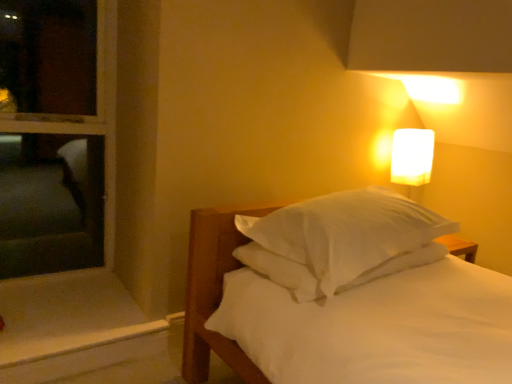
Question: From the image's perspective, does white frosted glass at upper right appear lower than white soft bed at center?

Choices:
 (A) no
 (B) yes

Answer: (A)

Question: Is white frosted glass at upper right closer to the viewer compared to white soft bed at center?

Choices:
 (A) no
 (B) yes

Answer: (A)

Question: Does white frosted glass at upper right appear on the left side of white soft bed at center?

Choices:
 (A) no
 (B) yes

Answer: (A)

Question: Does white frosted glass at upper right contain white soft bed at center?

Choices:
 (A) no
 (B) yes

Answer: (A)

Question: Is white frosted glass at upper right wider than white soft bed at center?

Choices:
 (A) yes
 (B) no

Answer: (B)

Question: From their relative heights in the image, would you say white soft bed at center is taller or shorter than white wood window sill at lower left?

Choices:
 (A) short
 (B) tall

Answer: (B)

Question: In the image, is white soft bed at center on the left side or the right side of white wood window sill at lower left?

Choices:
 (A) right
 (B) left

Answer: (A)

Question: Looking at their shapes, would you say white soft bed at center is wider or thinner than white wood window sill at lower left?

Choices:
 (A) thin
 (B) wide

Answer: (B)

Question: Is white soft bed at center situated inside white wood window sill at lower left or outside?

Choices:
 (A) inside
 (B) outside

Answer: (B)

Question: Is white frosted glass at upper right taller or shorter than white soft bed at center?

Choices:
 (A) short
 (B) tall

Answer: (A)

Question: Is white frosted glass at upper right inside the boundaries of white soft bed at center, or outside?

Choices:
 (A) outside
 (B) inside

Answer: (A)

Question: Considering the positions of white frosted glass at upper right and white soft bed at center in the image, is white frosted glass at upper right wider or thinner than white soft bed at center?

Choices:
 (A) thin
 (B) wide

Answer: (A)

Question: From the image's perspective, relative to white soft bed at center, is white frosted glass at upper right above or below?

Choices:
 (A) below
 (B) above

Answer: (B)

Question: In terms of height, does white frosted glass at upper right look taller or shorter compared to white wood window sill at lower left?

Choices:
 (A) short
 (B) tall

Answer: (B)

Question: From a real-world perspective, is white frosted glass at upper right above or below white wood window sill at lower left?

Choices:
 (A) above
 (B) below

Answer: (A)